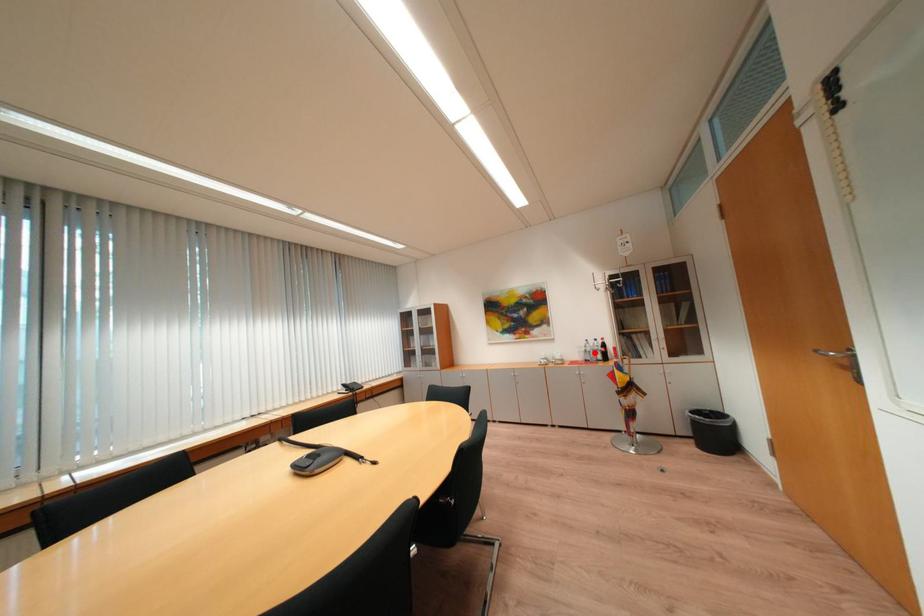
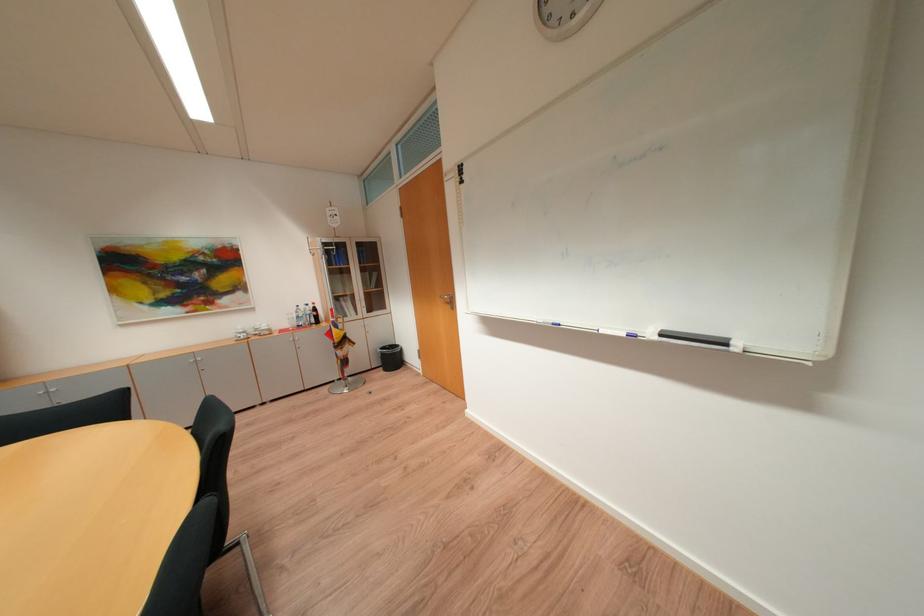
Locate, in the second image, the point that corresponds to the highlighted location in the first image.

(307, 318)